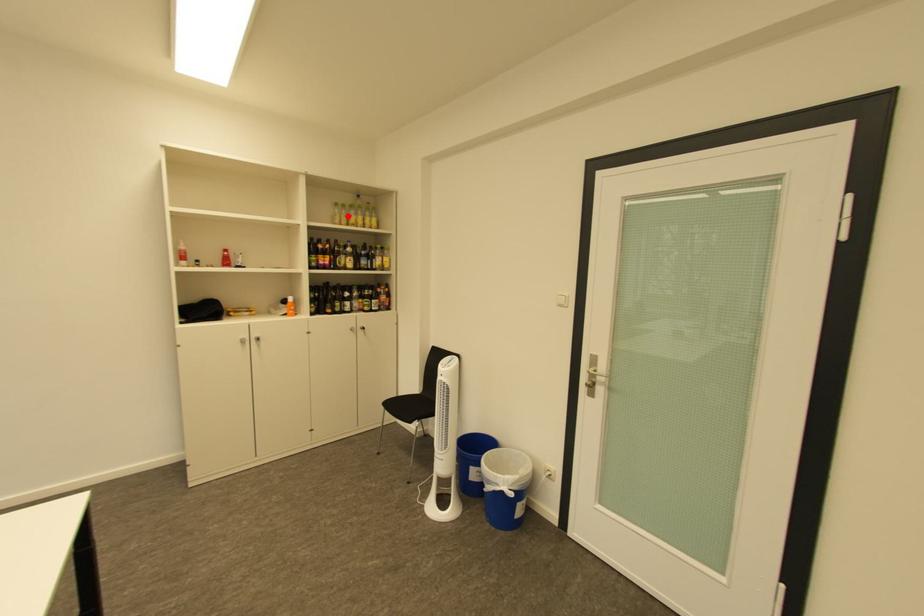
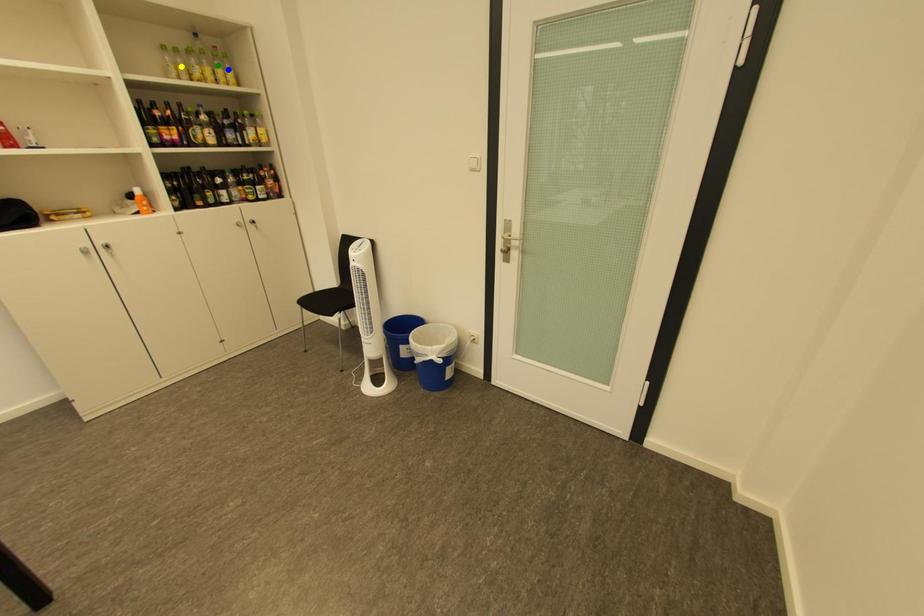
Question: I am providing you with two images of the same scene from different viewpoints. A red point is marked on the first image. You are given multiple points on the second image. Which spot in image 2 lines up with the point in image 1?

Choices:
 (A) green point
 (B) blue point
 (C) yellow point

Answer: (C)